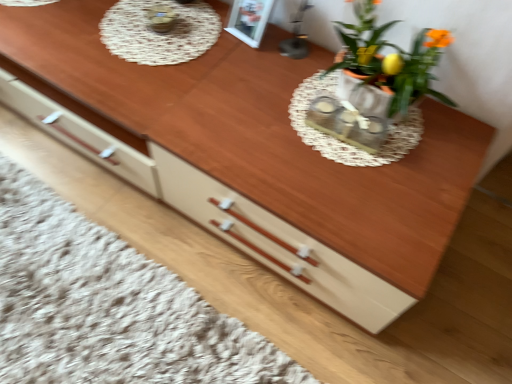
Find the location of a particular element. empty space that is in between white lace doily at upper center and matte orange pot at upper right is located at coordinates (242, 71).